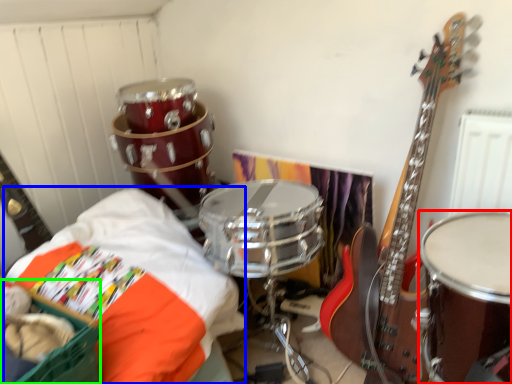
Question: Estimate the real-world distances between objects in this image. Which object is closer to drum (highlighted by a red box), sheet (highlighted by a blue box) or basket (highlighted by a green box)?

Choices:
 (A) sheet
 (B) basket

Answer: (A)